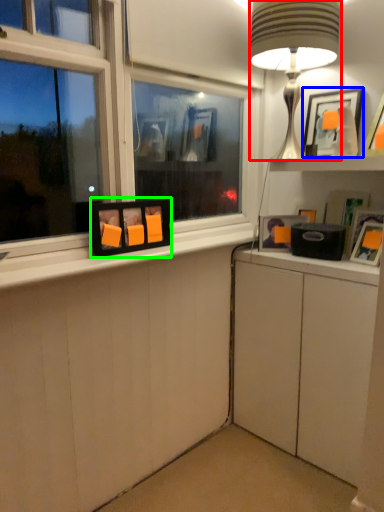
Question: Which object is the closest to the table lamp (highlighted by a red box)? Choose among these: picture frame (highlighted by a blue box) or picture frame (highlighted by a green box).

Choices:
 (A) picture frame
 (B) picture frame

Answer: (A)